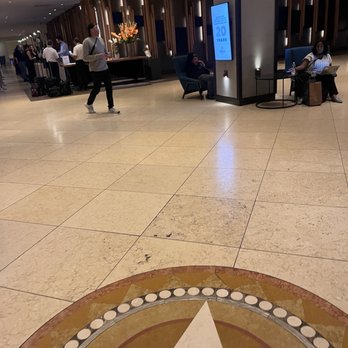
The image size is (348, 348). Find the location of `pattern on tile`. pattern on tile is located at coordinates (217, 322).